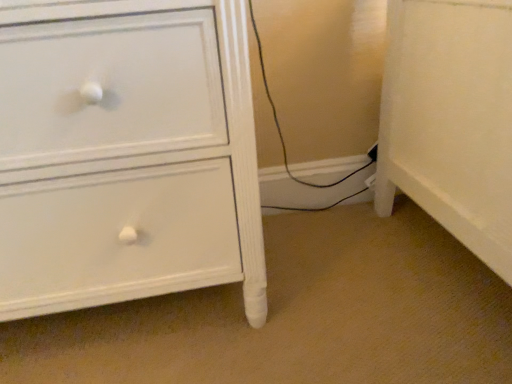
What is the approximate height of white painted wood chest of drawers at left?

white painted wood chest of drawers at left is 25.37 inches in height.

The width and height of the screenshot is (512, 384). Find the location of `white painted wood chest of drawers at left`. white painted wood chest of drawers at left is located at coordinates (126, 155).

The width and height of the screenshot is (512, 384). What do you see at coordinates (126, 155) in the screenshot?
I see `white painted wood chest of drawers at left` at bounding box center [126, 155].

The height and width of the screenshot is (384, 512). I want to click on white painted wood chest of drawers at left, so click(126, 155).